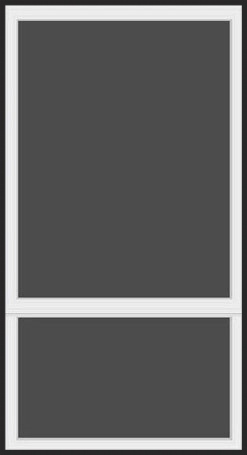
This screenshot has width=247, height=455. I want to click on corners of frame, so click(9, 444), click(235, 446), click(235, 315), click(12, 318), click(13, 11), click(12, 299), click(235, 301), click(235, 12).